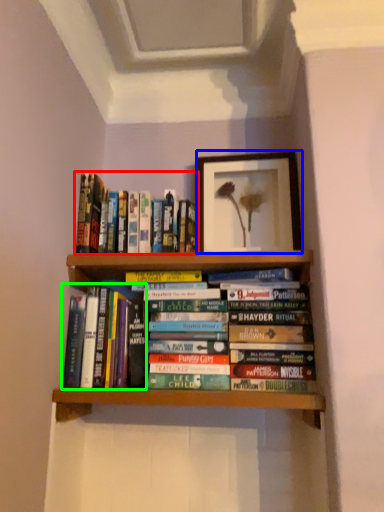
Question: Estimate the real-world distances between objects in this image. Which object is farther from book (highlighted by a red box), picture frame (highlighted by a blue box) or book (highlighted by a green box)?

Choices:
 (A) picture frame
 (B) book

Answer: (A)